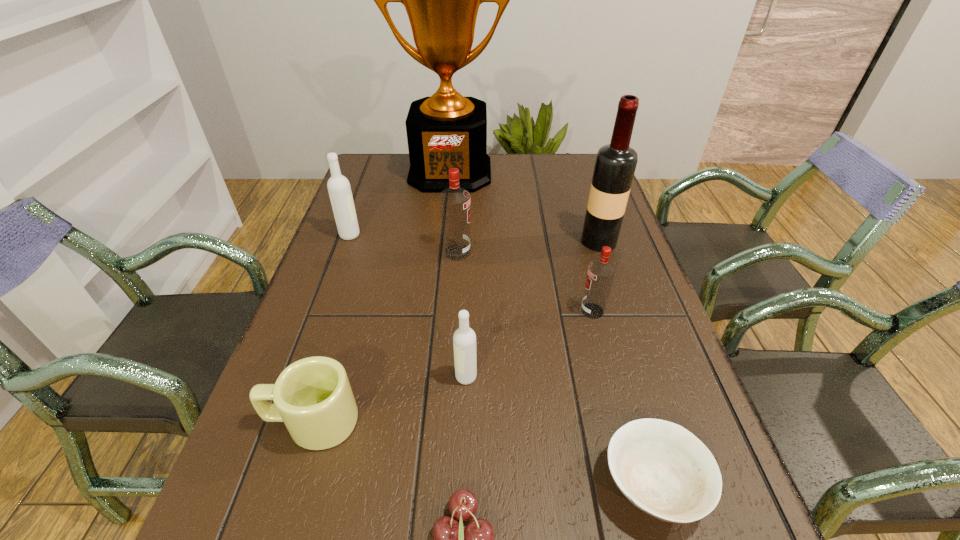
Locate an element on the screen. vacant region located 0.090m on the front of the smaller white vodka is located at coordinates (465, 429).

You are a GUI agent. You are given a task and a screenshot of the screen. Output one action in this format:
    pyautogui.click(x=<x>, y=<y>)
    Task: Click on the object present at the far edge
    
    Given the screenshot: What is the action you would take?
    pyautogui.click(x=446, y=130)

This screenshot has height=540, width=960. I want to click on trophy cup at the left edge, so point(446,130).

Find the location of a particular element. Image resolution: width=960 pixels, height=540 pixels. vodka that is at the left edge is located at coordinates (339, 189).

Locate an element on the screen. This screenshot has width=960, height=540. mug situated at the left edge is located at coordinates (312, 396).

In order to click on wine bottle located in the right edge section of the desktop in this screenshot , I will do `click(615, 164)`.

At what (x,y) coordinates should I click in order to perform the action: click on vodka present at the right edge. Please return your answer as a coordinate pair (x, y). This screenshot has height=540, width=960. Looking at the image, I should click on (601, 272).

Locate an element on the screen. The image size is (960, 540). object located in the far left corner section of the desktop is located at coordinates (446, 130).

You are a GUI agent. You are given a task and a screenshot of the screen. Output one action in this format:
    pyautogui.click(x=<x>, y=<y>)
    Task: Click on the vacant space at the far edge of the desktop
    The image size is (960, 540).
    Given the screenshot: What is the action you would take?
    pyautogui.click(x=540, y=159)

This screenshot has height=540, width=960. In the image, there is a desktop. Find the location of `vacant space at the left edge`. vacant space at the left edge is located at coordinates (258, 459).